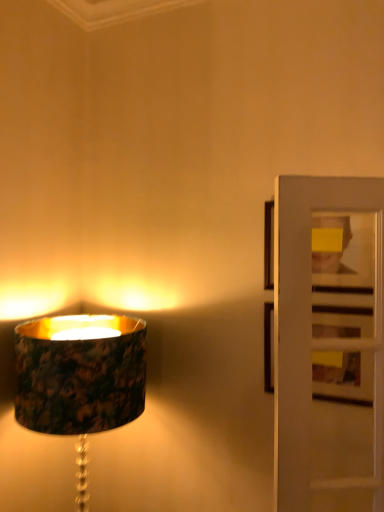
What is the approximate height of floral-patterned fabric lampshade at left?

floral-patterned fabric lampshade at left is 82.34 centimeters tall.

Identify the location of floral-patterned fabric lampshade at left. (80, 378).

The width and height of the screenshot is (384, 512). What do you see at coordinates (80, 378) in the screenshot? I see `floral-patterned fabric lampshade at left` at bounding box center [80, 378].

You are a GUI agent. You are given a task and a screenshot of the screen. Output one action in this format:
    pyautogui.click(x=<x>, y=<y>)
    Task: Click on the floral-patterned fabric lampshade at left
    
    Given the screenshot: What is the action you would take?
    pyautogui.click(x=80, y=378)